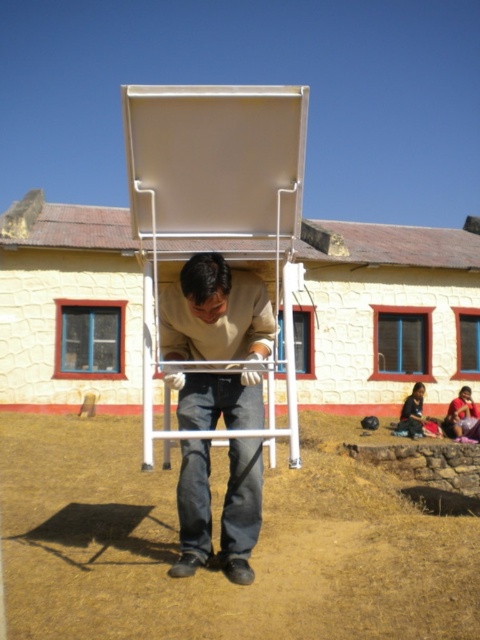
Question: Which object is closer to the camera taking this photo?

Choices:
 (A) white matte easel at center
 (B) matte beige shirt at center

Answer: (A)

Question: Does white matte easel at center come behind matte beige shirt at center?

Choices:
 (A) no
 (B) yes

Answer: (A)

Question: Which of the following is the farthest from the observer?

Choices:
 (A) (244, 374)
 (B) (297, 100)

Answer: (A)

Question: Can you confirm if white matte easel at center is wider than matte beige shirt at center?

Choices:
 (A) no
 (B) yes

Answer: (A)

Question: Does white matte easel at center appear under matte beige shirt at center?

Choices:
 (A) no
 (B) yes

Answer: (A)